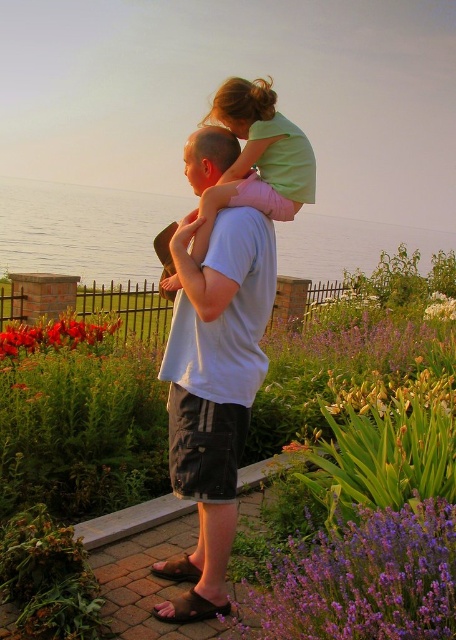
Question: Among these objects, which one is nearest to the camera?

Choices:
 (A) white matte flower at upper right
 (B) vivid red petals at lower left
 (C) yellow-green leafy plant at lower right
 (D) purple soft flower at lower right

Answer: (D)

Question: Is white cotton shirt at center further to the viewer compared to purple soft flower at lower right?

Choices:
 (A) yes
 (B) no

Answer: (A)

Question: Can you confirm if white cotton shirt at center is thinner than white matte flower at upper right?

Choices:
 (A) no
 (B) yes

Answer: (B)

Question: Which point is farther to the camera?

Choices:
 (A) green matte shirt at upper center
 (B) purple soft lavender at lower right
 (C) white cotton shirt at center

Answer: (B)

Question: Is purple leafy plants at center behind purple soft flower at lower right?

Choices:
 (A) no
 (B) yes

Answer: (B)

Question: Among these objects, which one is farthest from the camera?

Choices:
 (A) purple leafy plants at center
 (B) yellow-green leafy plant at lower right
 (C) vivid red petals at lower left
 (D) green matte shirt at upper center

Answer: (C)